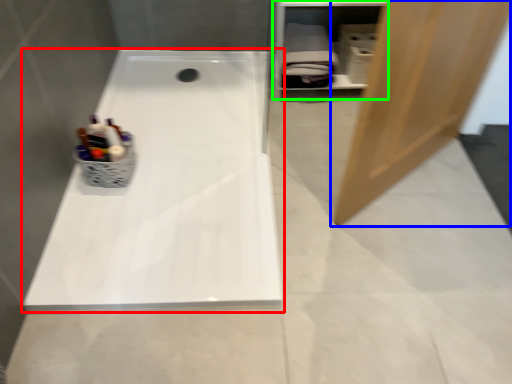
Question: Which object is positioned closest to bathtub (highlighted by a red box)? Select from door (highlighted by a blue box) and shelf (highlighted by a green box).

Choices:
 (A) door
 (B) shelf

Answer: (A)